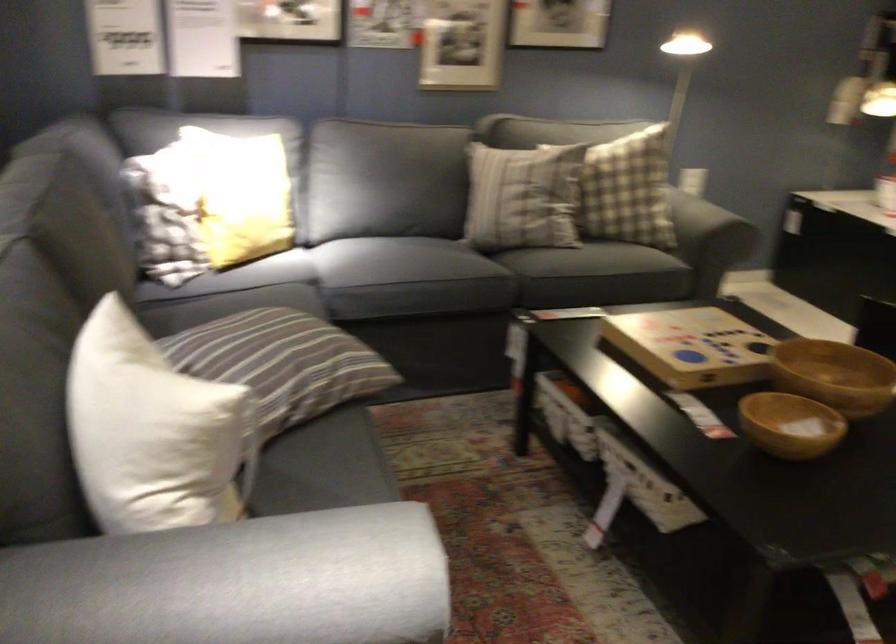
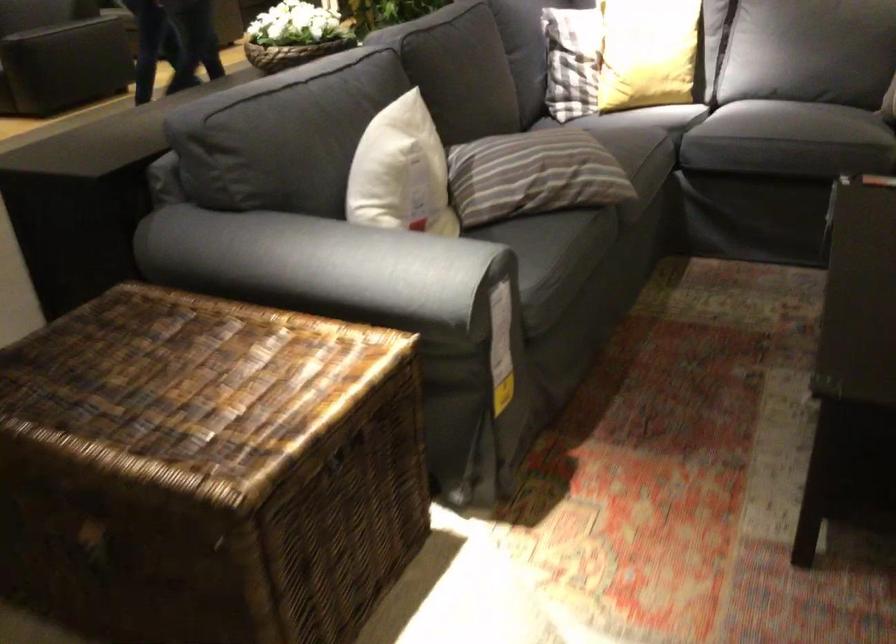
The point at (195,401) is marked in the first image. Where is the corresponding point in the second image?

(401, 172)